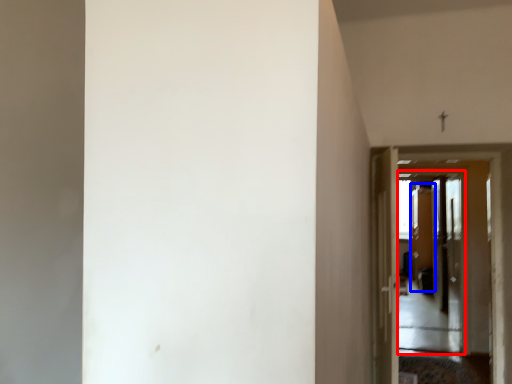
Question: Which point is further to the camera, screen door (highlighted by a red box) or screen door (highlighted by a blue box)?

Choices:
 (A) screen door
 (B) screen door

Answer: (B)